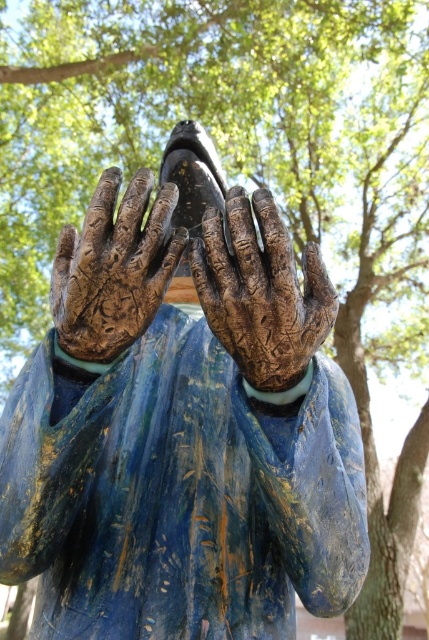
Question: Is bronze textured hands at center positioned in front of rusty metallic hand at center?

Choices:
 (A) yes
 (B) no

Answer: (A)

Question: Which of these objects is positioned farthest from the bronze textured hands at center?

Choices:
 (A) rusty metal hand at center
 (B) rusty metallic hand at center

Answer: (B)

Question: Which point is farther to the camera?

Choices:
 (A) (302, 376)
 (B) (69, 340)

Answer: (A)

Question: Is the position of bronze textured hands at center less distant than that of rusty metallic hand at center?

Choices:
 (A) no
 (B) yes

Answer: (B)

Question: Considering the relative positions of bronze textured hands at center and rusty metallic hand at center in the image provided, where is bronze textured hands at center located with respect to rusty metallic hand at center?

Choices:
 (A) below
 (B) above

Answer: (A)

Question: Which of these objects is positioned farthest from the bronze textured hands at center?

Choices:
 (A) rusty metallic hand at center
 (B) rusty metal hand at center

Answer: (A)